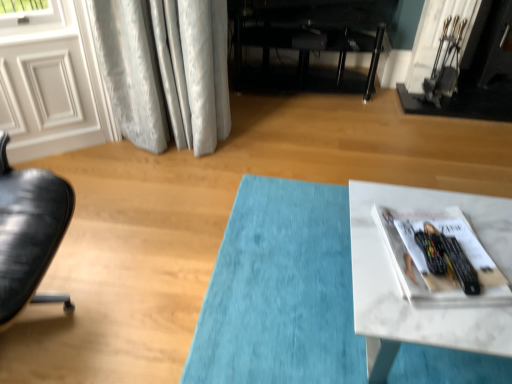
Question: Can you confirm if black metal fireplace at upper right is wider than white glossy magazine at lower right?

Choices:
 (A) no
 (B) yes

Answer: (A)

Question: Considering the relative sizes of black metal fireplace at upper right and white glossy magazine at lower right in the image provided, is black metal fireplace at upper right taller than white glossy magazine at lower right?

Choices:
 (A) yes
 (B) no

Answer: (A)

Question: From a real-world perspective, is black metal fireplace at upper right on top of white glossy magazine at lower right?

Choices:
 (A) yes
 (B) no

Answer: (B)

Question: From the image's perspective, would you say black metal fireplace at upper right is shown under white glossy magazine at lower right?

Choices:
 (A) no
 (B) yes

Answer: (A)

Question: Is white glossy magazine at lower right located within black metal fireplace at upper right?

Choices:
 (A) yes
 (B) no

Answer: (B)

Question: Considering the relative sizes of black metal fireplace at upper right and white glossy magazine at lower right in the image provided, is black metal fireplace at upper right smaller than white glossy magazine at lower right?

Choices:
 (A) no
 (B) yes

Answer: (A)

Question: Can you confirm if white glossy magazine at lower right is wider than black metal fireplace at upper right?

Choices:
 (A) no
 (B) yes

Answer: (B)

Question: Can you confirm if white glossy magazine at lower right is shorter than black metal fireplace at upper right?

Choices:
 (A) no
 (B) yes

Answer: (B)

Question: From the image's perspective, does white glossy magazine at lower right appear lower than black metal fireplace at upper right?

Choices:
 (A) yes
 (B) no

Answer: (A)

Question: Is white glossy magazine at lower right positioned before black metal fireplace at upper right?

Choices:
 (A) yes
 (B) no

Answer: (A)

Question: Does white glossy magazine at lower right turn towards black metal fireplace at upper right?

Choices:
 (A) yes
 (B) no

Answer: (B)

Question: Does white glossy magazine at lower right have a larger size compared to black metal fireplace at upper right?

Choices:
 (A) yes
 (B) no

Answer: (B)

Question: Can you confirm if white marble table at lower right is positioned to the left of white glossy magazine at lower right?

Choices:
 (A) yes
 (B) no

Answer: (B)